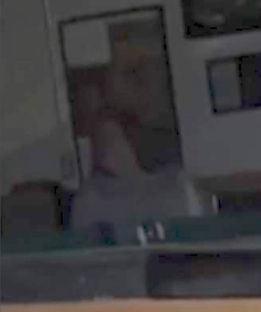
Identify the location of shelf. (221, 21).